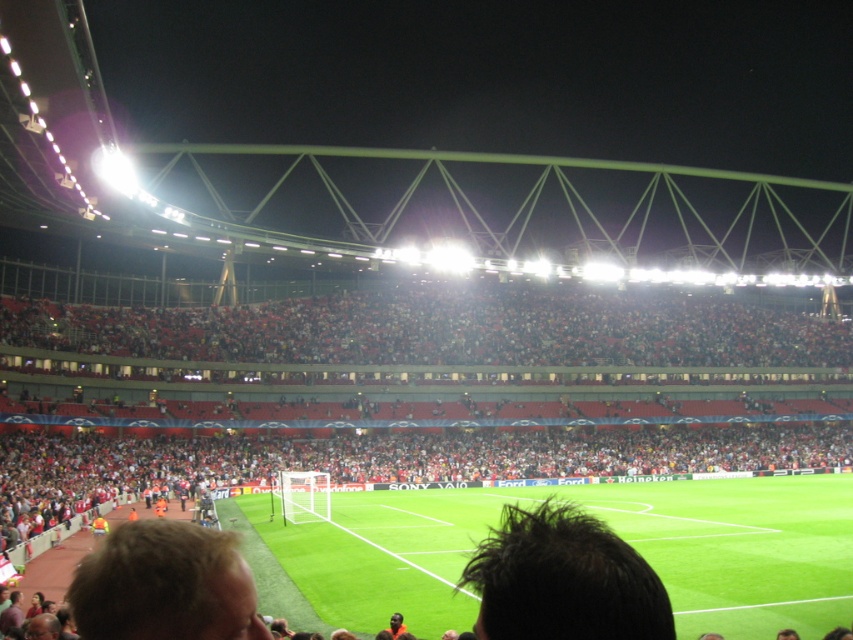
You are a photographer at the soccer stadium and want to capture a photo of both the dark brown hair at center and the blonde hair at lower left in the same frame. Considering their heights, which person should you focus on first to ensure both are visible?

The dark brown hair at center is taller than the blonde hair at lower left. To ensure both are visible in the photo, focus on the dark brown hair at center first, then adjust the angle to include the shorter blonde hair at lower left.

You are a photographer trying to capture a wide shot of the soccer stadium. You notice the green grass football field at center and the dark brown hair at center. Which object should you focus on to ensure the entire scene is in frame?

The green grass football field at center is bigger than the dark brown hair at center, so focusing on the larger object, the green grass football field at center, will help ensure the entire scene is captured in the frame.

You are a photographer standing at the edge of the field. You want to take a photo of the blonde hair at lower left and the green grass football field at center. Which object should you focus on first if you want to capture both in the same frame?

The green grass football field at center is located below blonde hair at lower left, so you should focus on the blonde hair at lower left first as it is closer to the camera and then adjust to include the field below it.